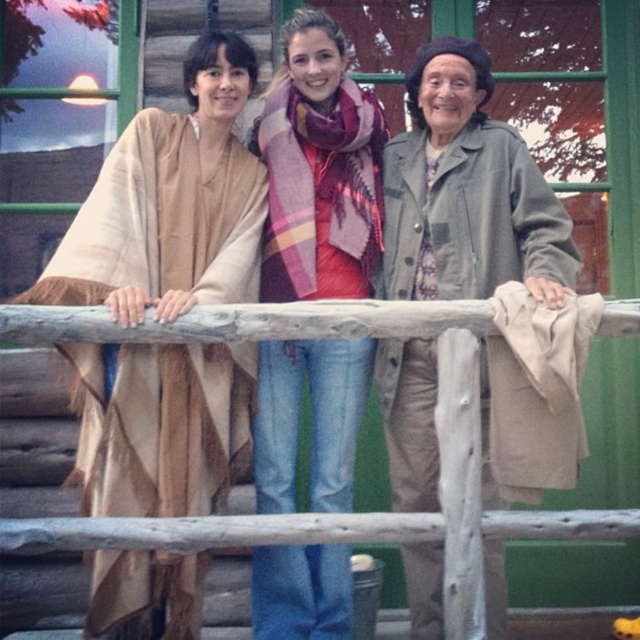
Question: Among these points, which one is farthest from the camera?

Choices:
 (A) (84, 378)
 (B) (464, 524)

Answer: (A)

Question: Does wooden at center appear over plaid wool scarf at center?

Choices:
 (A) no
 (B) yes

Answer: (A)

Question: Does beige woven poncho at left have a smaller size compared to wooden at center?

Choices:
 (A) yes
 (B) no

Answer: (B)

Question: Considering the real-world distances, which object is closest to the plaid scarf at center?

Choices:
 (A) beige woven poncho at left
 (B) plaid wool scarf at center

Answer: (B)

Question: Considering the real-world distances, which object is closest to the plaid wool scarf at center?

Choices:
 (A) plaid scarf at center
 (B) wooden at center

Answer: (A)

Question: Is beige woven poncho at left smaller than wooden at center?

Choices:
 (A) yes
 (B) no

Answer: (B)